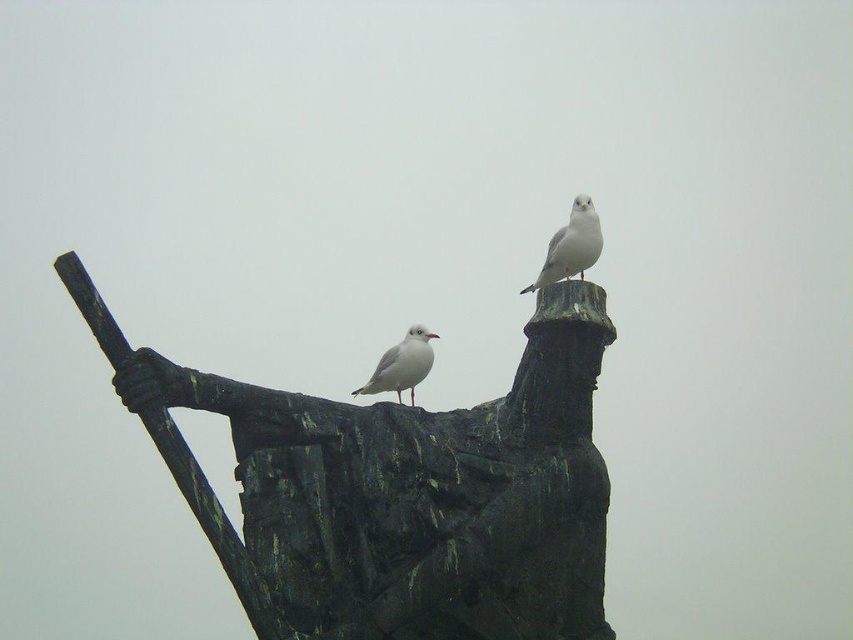
Question: Which point is farther to the camera?

Choices:
 (A) white matte bird at center
 (B) green patina statue at center
 (C) white matte bird at upper center

Answer: (C)

Question: Does green patina statue at center lie in front of white matte bird at center?

Choices:
 (A) yes
 (B) no

Answer: (A)

Question: In this image, where is green patina statue at center located relative to white matte bird at center?

Choices:
 (A) above
 (B) below

Answer: (B)

Question: Which point appears closest to the camera in this image?

Choices:
 (A) (567, 236)
 (B) (402, 362)
 (C) (541, 484)

Answer: (C)

Question: Can you confirm if green patina statue at center is thinner than white matte bird at upper center?

Choices:
 (A) yes
 (B) no

Answer: (B)

Question: Among these objects, which one is nearest to the camera?

Choices:
 (A) white matte bird at upper center
 (B) green patina statue at center
 (C) white matte bird at center

Answer: (B)